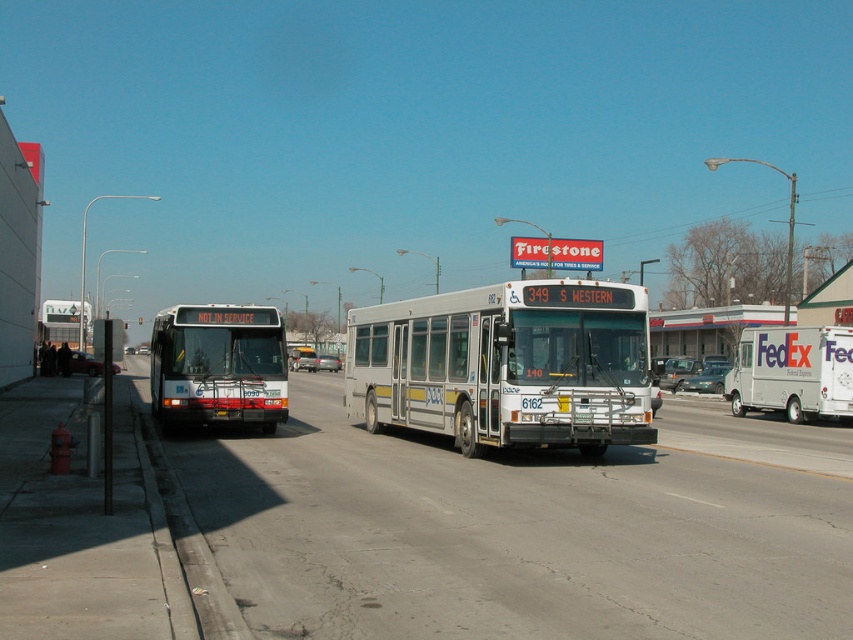
Question: Is the position of white metallic bus at center more distant than that of white matte bus at center?

Choices:
 (A) no
 (B) yes

Answer: (A)

Question: Among these points, which one is nearest to the camera?

Choices:
 (A) (479, 387)
 (B) (173, 365)

Answer: (A)

Question: Which of the following is the closest to the observer?

Choices:
 (A) white matte bus at center
 (B) white metallic bus at center

Answer: (B)

Question: Does white metallic bus at center appear on the right side of white matte bus at center?

Choices:
 (A) no
 (B) yes

Answer: (B)

Question: Can you confirm if white metallic bus at center is wider than white matte bus at center?

Choices:
 (A) yes
 (B) no

Answer: (B)